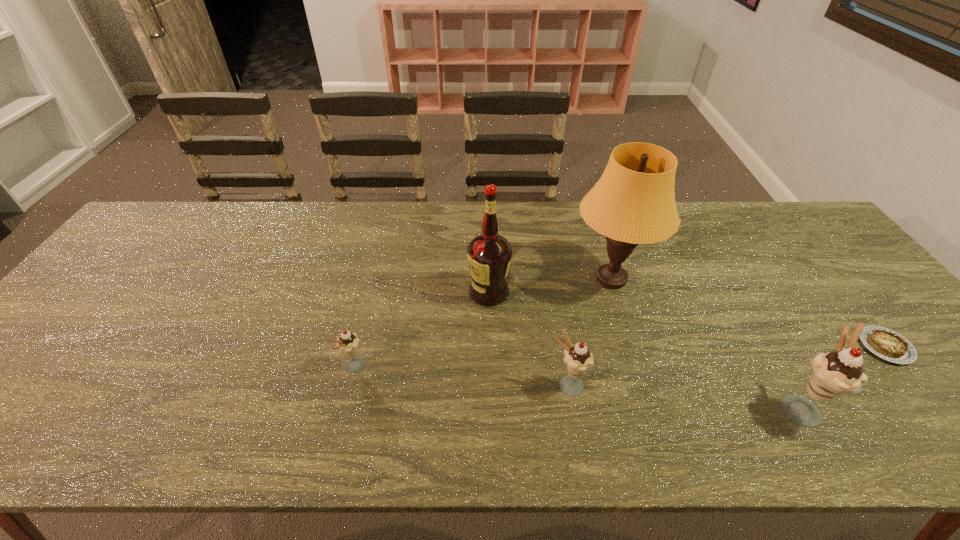
Find the location of a particular element. free space between the lampshade and the second object from left to right is located at coordinates (550, 285).

This screenshot has width=960, height=540. In order to click on vacant area that lies between the rightmost object and the fifth tallest object in this screenshot , I will do `click(620, 357)`.

At what (x,y) coordinates should I click in order to perform the action: click on vacant area between the alcohol and the lampshade. Please return your answer as a coordinate pair (x, y). Looking at the image, I should click on (550, 285).

Where is `vacant area that lies between the shortest icecream and the quiche`? The image size is (960, 540). vacant area that lies between the shortest icecream and the quiche is located at coordinates (620, 357).

Find the location of `vacant space in between the fourth object from left to right and the third object from left to right`. vacant space in between the fourth object from left to right and the third object from left to right is located at coordinates (589, 332).

In order to click on the closest object to the lampshade in this screenshot , I will do `click(489, 254)`.

I want to click on object that can be found as the closest to the third object from right to left, so click(489, 254).

You are a GUI agent. You are given a task and a screenshot of the screen. Output one action in this format:
    pyautogui.click(x=<x>, y=<y>)
    Task: Click on the icecream that is the second closest to the rightmost icecream
    The image size is (960, 540).
    Given the screenshot: What is the action you would take?
    pyautogui.click(x=348, y=343)

In order to click on icecream that can be found as the second closest to the third object from right to left in this screenshot , I will do `click(834, 374)`.

Locate an element on the screen. This screenshot has height=540, width=960. free location that satisfies the following two spatial constraints: 1. on the label of the rightmost object; 2. on the right side of the fifth object from right to left is located at coordinates (490, 347).